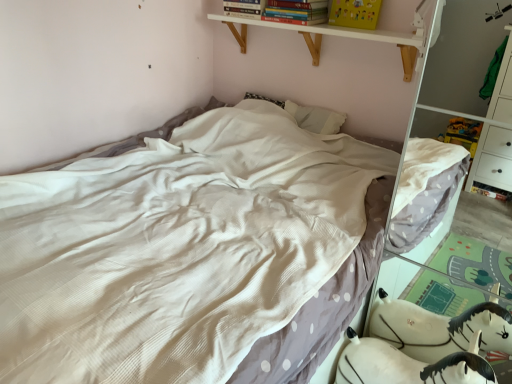
This screenshot has height=384, width=512. Find the location of `free point above white wood shelf at upper center (from a real-world perspective)`. free point above white wood shelf at upper center (from a real-world perspective) is located at coordinates (328, 26).